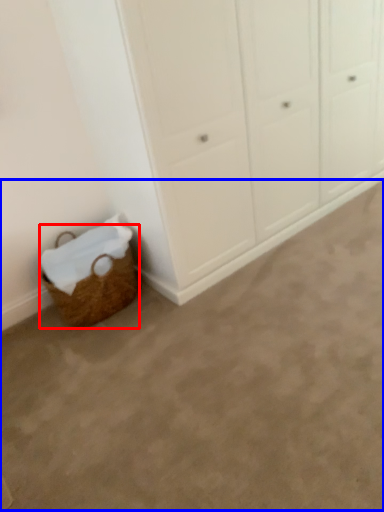
Question: Which of the following is the closest to the observer, basket (highlighted by a red box) or plain (highlighted by a blue box)?

Choices:
 (A) basket
 (B) plain

Answer: (B)